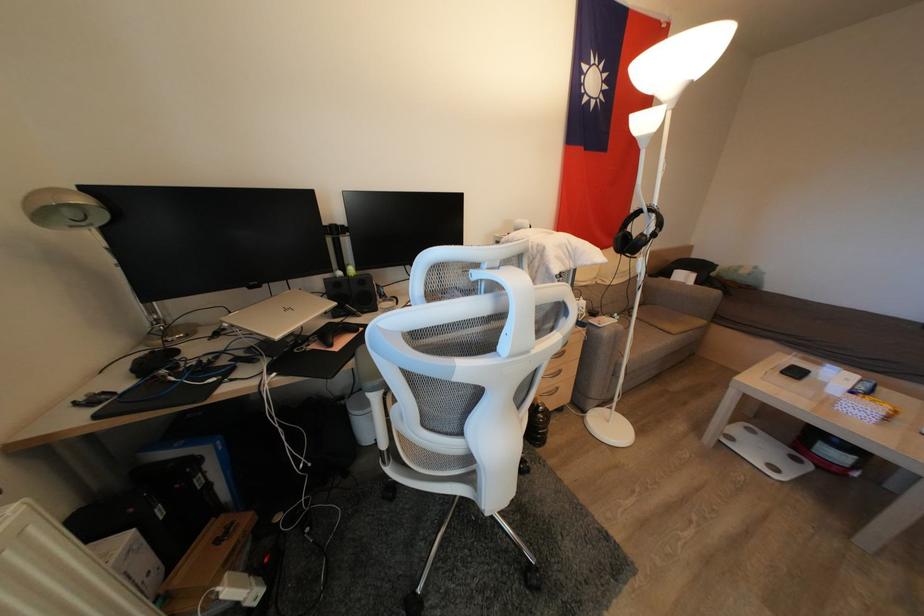
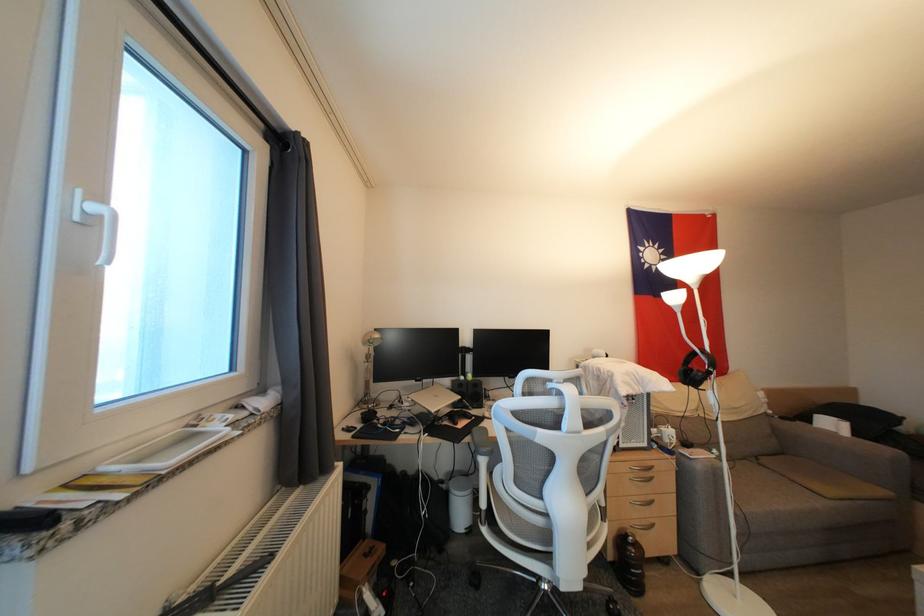
Where in the second image is the point corresponding to (550,414) from the first image?

(642, 549)